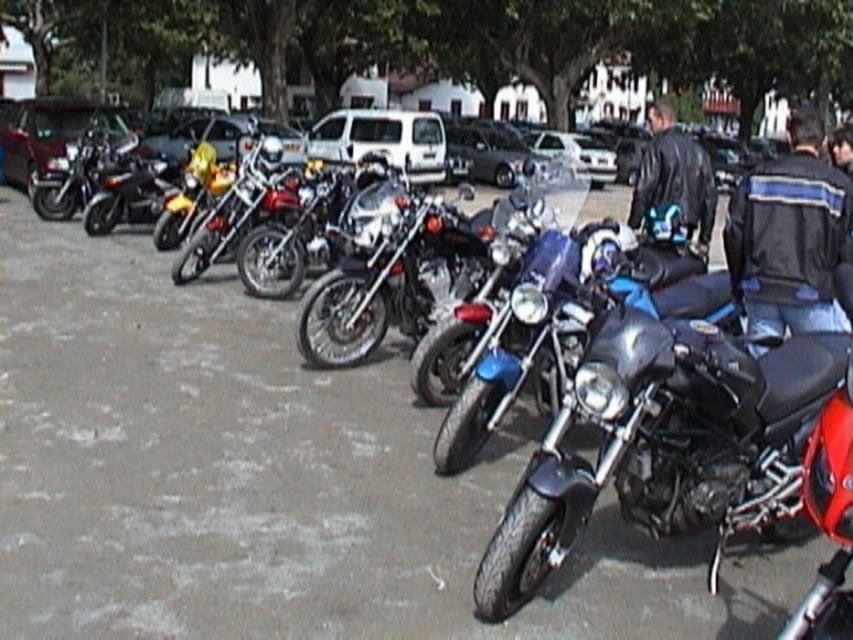
Question: Estimate the real-world distances between objects in this image. Which object is closer to the black leather jacket at center?

Choices:
 (A) leather jacket at center
 (B) shiny blue motorcycle at center
 (C) metallic silver car at center
 (D) shiny chrome motorcycle at center

Answer: (B)

Question: Can you confirm if shiny blue motorcycle at center is positioned to the right of black leather jacket at center?

Choices:
 (A) yes
 (B) no

Answer: (B)

Question: Does shiny blue motorcycle at center have a lesser width compared to metallic silver car at center?

Choices:
 (A) no
 (B) yes

Answer: (B)

Question: Which of these objects is positioned closest to the shiny blue motorcycle at center?

Choices:
 (A) leather jacket at center
 (B) black leather jacket at center

Answer: (B)

Question: Among these points, which one is farthest from the camera?

Choices:
 (A) (805, 198)
 (B) (335, 349)
 (C) (706, 236)

Answer: (C)

Question: Is shiny blue motorcycle at center in front of leather jacket at center?

Choices:
 (A) yes
 (B) no

Answer: (A)